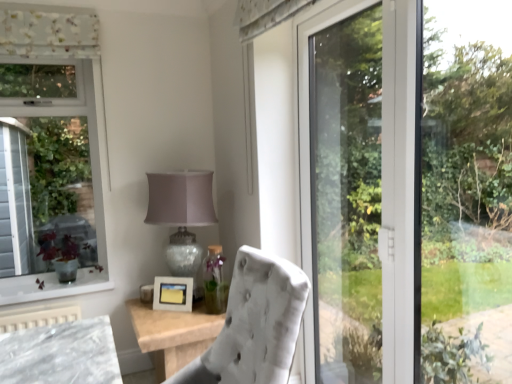
Question: Is matte glass table lamp at center oriented away from white matte picture frame at center?

Choices:
 (A) no
 (B) yes

Answer: (A)

Question: From the image's perspective, does matte glass table lamp at center appear higher than white matte picture frame at center?

Choices:
 (A) no
 (B) yes

Answer: (B)

Question: Is matte glass table lamp at center far from white matte picture frame at center?

Choices:
 (A) yes
 (B) no

Answer: (B)

Question: Is white matte picture frame at center located within matte glass table lamp at center?

Choices:
 (A) yes
 (B) no

Answer: (A)

Question: From the image's perspective, is matte glass table lamp at center below white matte picture frame at center?

Choices:
 (A) yes
 (B) no

Answer: (B)

Question: Is the position of matte glass table lamp at center more distant than that of white matte picture frame at center?

Choices:
 (A) no
 (B) yes

Answer: (A)

Question: Could you tell me if velvet white chair at center is turned towards matte glass table lamp at center?

Choices:
 (A) yes
 (B) no

Answer: (B)

Question: Does velvet white chair at center have a greater width compared to matte glass table lamp at center?

Choices:
 (A) yes
 (B) no

Answer: (A)

Question: Is velvet white chair at center smaller than matte glass table lamp at center?

Choices:
 (A) yes
 (B) no

Answer: (B)

Question: Does velvet white chair at center lie behind matte glass table lamp at center?

Choices:
 (A) no
 (B) yes

Answer: (A)

Question: Is velvet white chair at center positioned beyond the bounds of matte glass table lamp at center?

Choices:
 (A) no
 (B) yes

Answer: (B)

Question: Can you confirm if velvet white chair at center is thinner than matte glass table lamp at center?

Choices:
 (A) yes
 (B) no

Answer: (B)

Question: From the image's perspective, is transparent glass door at right on velvet white chair at center?

Choices:
 (A) no
 (B) yes

Answer: (B)